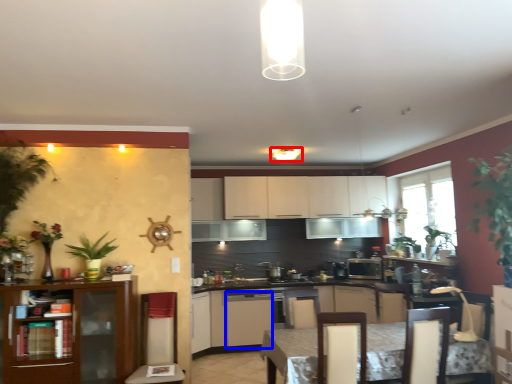
Question: Which point is further to the camera, lighting (highlighted by a red box) or cabinetry (highlighted by a blue box)?

Choices:
 (A) lighting
 (B) cabinetry

Answer: (B)